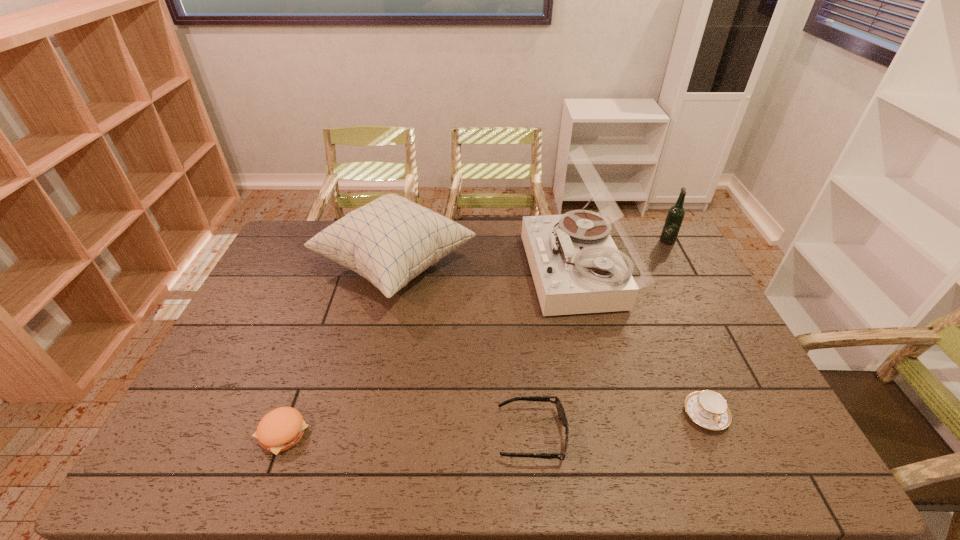
Find the location of a particular element. Image resolution: width=960 pixels, height=540 pixels. free space located on the front-facing side of the sunglasses is located at coordinates (458, 435).

Where is `free region located on the front-facing side of the sunglasses`? This screenshot has height=540, width=960. free region located on the front-facing side of the sunglasses is located at coordinates tap(348, 435).

Find the location of `vacant area situated on the front-facing side of the sunglasses`. vacant area situated on the front-facing side of the sunglasses is located at coordinates (420, 435).

Where is `vacant space located on the right of the patty`? Image resolution: width=960 pixels, height=540 pixels. vacant space located on the right of the patty is located at coordinates (397, 434).

This screenshot has height=540, width=960. Find the location of `record player positioned at the far edge`. record player positioned at the far edge is located at coordinates (576, 267).

Locate an element on the screen. The image size is (960, 540). cushion located in the far edge section of the desktop is located at coordinates (391, 240).

In order to click on beer bottle that is at the far edge in this screenshot , I will do `click(675, 216)`.

Find the location of a particular element. This screenshot has width=960, height=540. sunglasses present at the near edge is located at coordinates (560, 409).

Where is `patty present at the near edge`? This screenshot has height=540, width=960. patty present at the near edge is located at coordinates (280, 429).

You are a GUI agent. You are given a task and a screenshot of the screen. Output one action in this format:
    pyautogui.click(x=<x>, y=<y>)
    Task: Click on the beer bottle present at the right edge
    This screenshot has height=540, width=960.
    Given the screenshot: What is the action you would take?
    pyautogui.click(x=675, y=216)